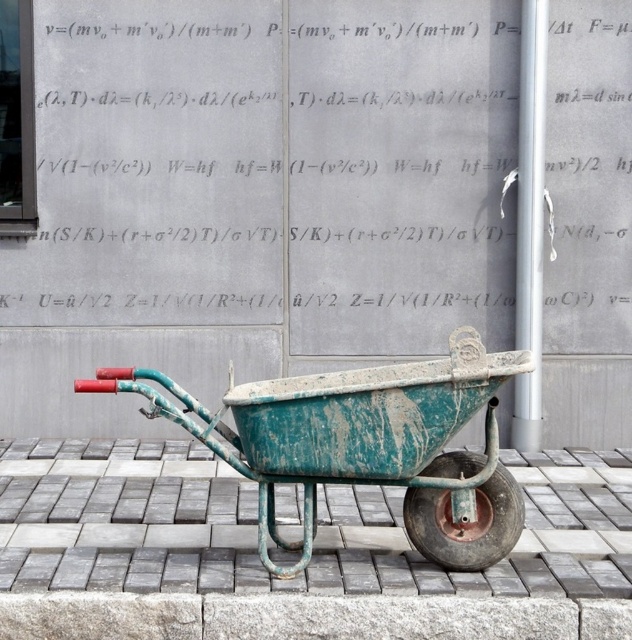
You are standing at the point with coordinates 0.5,0.5 in the image. You want to walk to the green weathered pavement at center. Which direction should you move in?

The green weathered pavement at center is located at coordinates (308,564). Since you are at (316,320), you should move towards the right direction to reach it.

You are a maintenance worker inspecting the green weathered pavement at center and the rusty metal wheel at lower center. Which object is closer to you from your current viewpoint?

The green weathered pavement at center is closer to you because it is in front of the rusty metal wheel at lower center.

You are standing in a garden and see the green weathered wheelbarrow at center and the rusty metal wheel at lower center. Which object is located to the left of the other?

The green weathered wheelbarrow at center is positioned on the left side of rusty metal wheel at lower center.